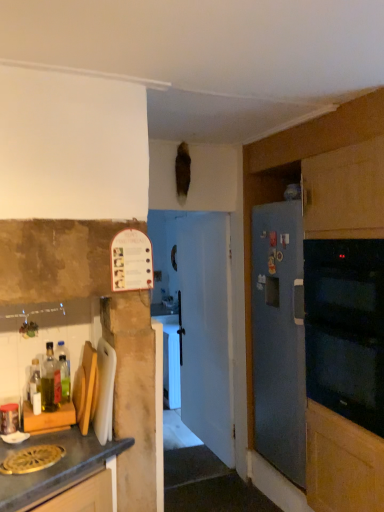
Question: From a real-world perspective, is white plastic cutting board at left on top of matte wood cutting board at lower left, marked as the first cabinetry in a left-to-right arrangement?

Choices:
 (A) no
 (B) yes

Answer: (B)

Question: Is white plastic cutting board at left positioned beyond the bounds of matte wood cutting board at lower left, placed as the first cabinetry when sorted from front to back?

Choices:
 (A) no
 (B) yes

Answer: (B)

Question: Does white plastic cutting board at left have a lesser width compared to matte wood cutting board at lower left, placed as the first cabinetry when sorted from front to back?

Choices:
 (A) no
 (B) yes

Answer: (B)

Question: Could you tell me if white plastic cutting board at left is facing matte wood cutting board at lower left, positioned as the second cabinetry in back-to-front order?

Choices:
 (A) no
 (B) yes

Answer: (A)

Question: Is white plastic cutting board at left looking in the opposite direction of matte wood cutting board at lower left, marked as the first cabinetry in a left-to-right arrangement?

Choices:
 (A) yes
 (B) no

Answer: (B)

Question: Is white plastic cutting board at left situated inside translucent glass bottle at left, which is the 1th bottle in front-to-back order, or outside?

Choices:
 (A) inside
 (B) outside

Answer: (B)

Question: From the image's perspective, relative to translucent glass bottle at left, which is the 1th bottle in front-to-back order, is white plastic cutting board at left above or below?

Choices:
 (A) below
 (B) above

Answer: (A)

Question: Is white plastic cutting board at left taller or shorter than translucent glass bottle at left, the 2th bottle viewed from the back?

Choices:
 (A) tall
 (B) short

Answer: (A)

Question: Is white plastic cutting board at left bigger or smaller than translucent glass bottle at left, the 2th bottle viewed from the back?

Choices:
 (A) small
 (B) big

Answer: (B)

Question: Considering the positions of matte wood cutting board at lower left, which is the second cabinetry in right-to-left order, and black glass oven at right in the image, is matte wood cutting board at lower left, which is the second cabinetry in right-to-left order, taller or shorter than black glass oven at right?

Choices:
 (A) short
 (B) tall

Answer: (A)

Question: Would you say matte wood cutting board at lower left, positioned as the second cabinetry in back-to-front order, is inside or outside black glass oven at right?

Choices:
 (A) outside
 (B) inside

Answer: (A)

Question: From the image's perspective, relative to black glass oven at right, is matte wood cutting board at lower left, which is the second cabinetry in right-to-left order, above or below?

Choices:
 (A) below
 (B) above

Answer: (A)

Question: Looking at their shapes, would you say matte wood cutting board at lower left, placed as the first cabinetry when sorted from front to back, is wider or thinner than black glass oven at right?

Choices:
 (A) wide
 (B) thin

Answer: (A)

Question: From a real-world perspective, relative to white plastic cutting board at left, is black glass oven at right vertically above or below?

Choices:
 (A) above
 (B) below

Answer: (A)

Question: Is point (362, 342) closer or farther from the camera than point (99, 360)?

Choices:
 (A) farther
 (B) closer

Answer: (A)